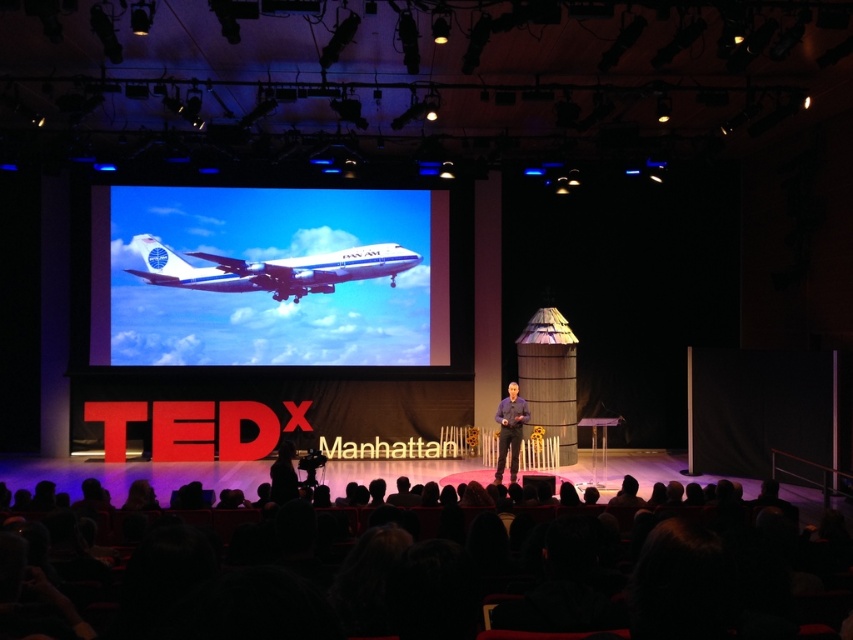
You are an attendee at the TEDx Manhattan event. You notice the white glossy airplane at upper center and the silky black hair at lower center. Which object is positioned higher in the image?

The white glossy airplane at upper center is positioned higher in the image than the silky black hair at lower center.

You are an attendee at the TEDx Manhattan event. You notice the white glossy airplane at upper center and the silky black hair at lower center. From your seat, which object is positioned to the left?

The white glossy airplane at upper center is positioned to the left of the silky black hair at lower center.